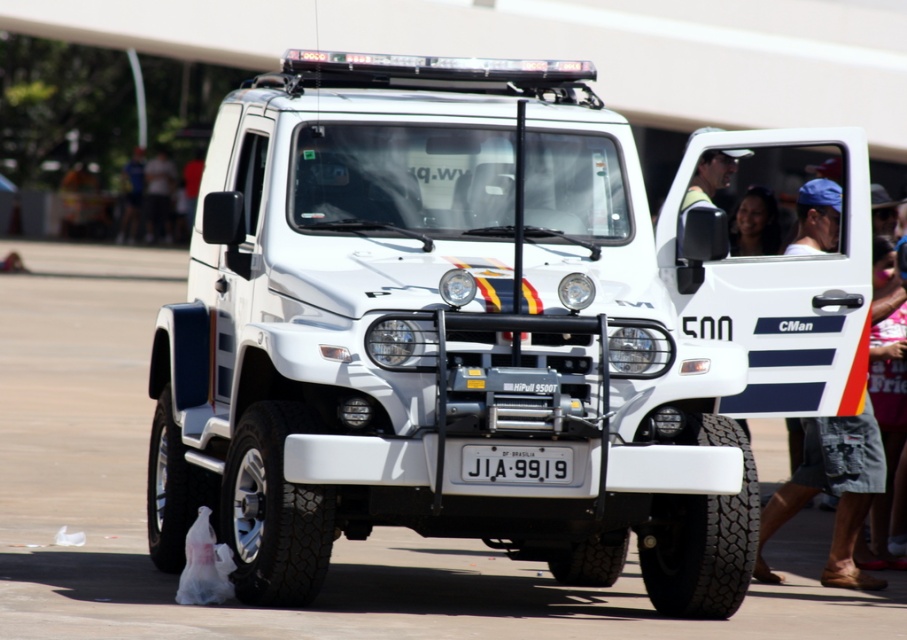
Question: Which of the following is the farthest from the observer?

Choices:
 (A) blue denim shorts at right
 (B) white matte truck at center
 (C) white plastic license plate at center

Answer: (B)

Question: Which point is farther to the camera?

Choices:
 (A) blue denim shorts at right
 (B) white plastic license plate at center

Answer: (A)

Question: Observing the image, what is the correct spatial positioning of white matte truck at center in reference to white plastic license plate at center?

Choices:
 (A) left
 (B) right

Answer: (A)

Question: Which object is the farthest from the blue denim shorts at right?

Choices:
 (A) white matte truck at center
 (B) white plastic license plate at center

Answer: (A)

Question: Can you confirm if white matte truck at center is smaller than blue denim shorts at right?

Choices:
 (A) yes
 (B) no

Answer: (A)

Question: Is white matte truck at center bigger than blue denim shorts at right?

Choices:
 (A) no
 (B) yes

Answer: (A)